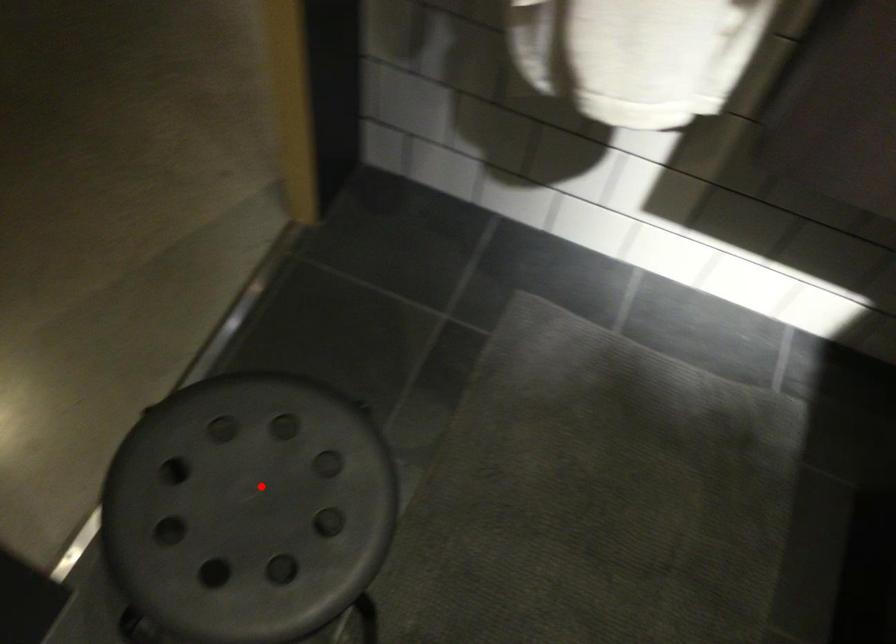
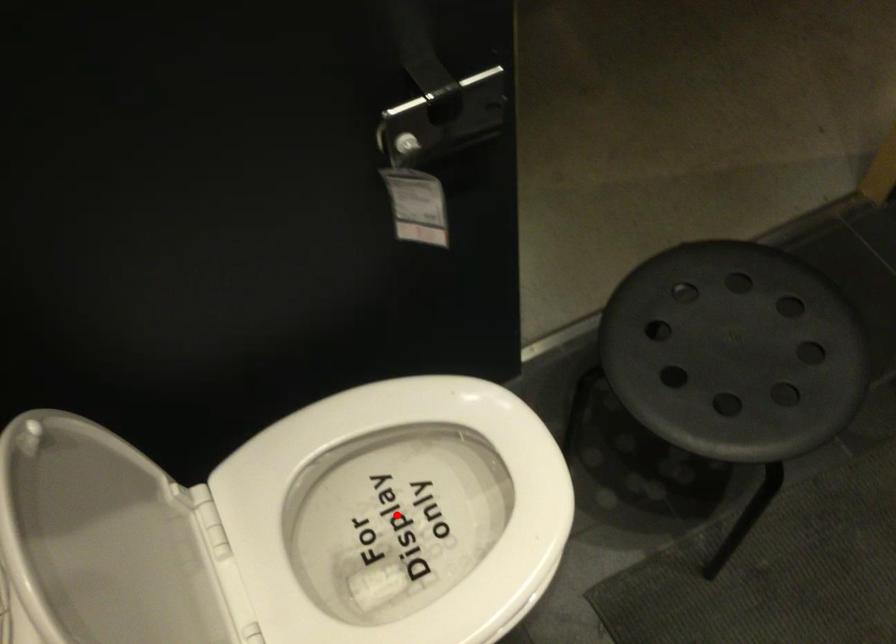
I am providing you with two images of the same scene from different viewpoints. A red point is marked on the first image and another point is marked on the second image. Does the point marked in image1 correspond to the same location as the one in image2?

No